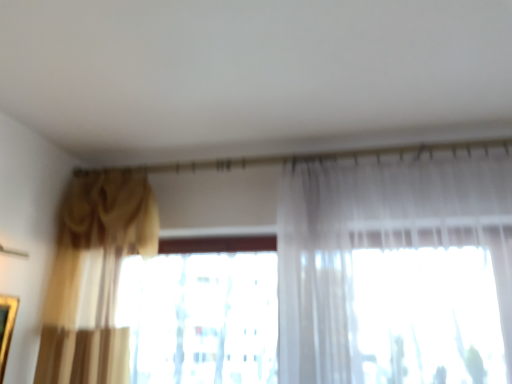
What do you see at coordinates (201, 317) in the screenshot?
I see `translucent fabric at center` at bounding box center [201, 317].

Locate an element on the screen. The width and height of the screenshot is (512, 384). translucent fabric at center is located at coordinates (201, 317).

Image resolution: width=512 pixels, height=384 pixels. Find the location of `gold textured curtain at left`. gold textured curtain at left is located at coordinates pos(94,276).

The image size is (512, 384). What do you see at coordinates (94, 276) in the screenshot? I see `gold textured curtain at left` at bounding box center [94, 276].

Find the location of `translucent fabric at center`. translucent fabric at center is located at coordinates (201, 317).

Based on the photo, considering the positions of objects translucent fabric at center and gold textured curtain at left in the image provided, who is more to the right, translucent fabric at center or gold textured curtain at left?

Positioned to the right is translucent fabric at center.

Does translucent fabric at center come in front of gold textured curtain at left?

No, translucent fabric at center is behind gold textured curtain at left.

Considering the positions of points (137, 263) and (63, 252), is point (137, 263) farther from camera compared to point (63, 252)?

No, it is in front of (63, 252).

From the image's perspective, who appears lower, translucent fabric at center or gold textured curtain at left?

From the image's view, translucent fabric at center is below.

From a real-world perspective, between translucent fabric at center and gold textured curtain at left, who is vertically higher?

gold textured curtain at left is physically above.

Is translucent fabric at center wider than gold textured curtain at left?

In fact, translucent fabric at center might be narrower than gold textured curtain at left.

Is translucent fabric at center taller than gold textured curtain at left?

In fact, translucent fabric at center may be shorter than gold textured curtain at left.

Looking at the image, does translucent fabric at center seem bigger or smaller compared to gold textured curtain at left?

In the image, translucent fabric at center appears to be smaller than gold textured curtain at left.

Would you say translucent fabric at center contains gold textured curtain at left?

No.

Is translucent fabric at center beside gold textured curtain at left?

No, translucent fabric at center is not next to gold textured curtain at left.

Is translucent fabric at center positioned with its back to gold textured curtain at left?

No, translucent fabric at center is not facing away from gold textured curtain at left.

How different are the orientations of translucent fabric at center and gold textured curtain at left in degrees?

The angle between the facing direction of translucent fabric at center and the facing direction of gold textured curtain at left is 0.295 degrees.

Find the location of a particular element. The width and height of the screenshot is (512, 384). window that is behind the gold textured curtain at left is located at coordinates click(x=201, y=317).

Based on their positions, is gold textured curtain at left located to the left or right of translucent fabric at center?

gold textured curtain at left is to the left of translucent fabric at center.

Considering the positions of objects gold textured curtain at left and translucent fabric at center in the image provided, who is behind, gold textured curtain at left or translucent fabric at center?

translucent fabric at center is more distant.

Does point (41, 364) come behind point (189, 376)?

That is False.

From the image's perspective, between gold textured curtain at left and translucent fabric at center, which one is located above?

gold textured curtain at left is shown above in the image.

Consider the image. From a real-world perspective, is gold textured curtain at left under translucent fabric at center?

Incorrect, from a real-world perspective, gold textured curtain at left is higher than translucent fabric at center.

Is gold textured curtain at left wider than translucent fabric at center?

Correct, the width of gold textured curtain at left exceeds that of translucent fabric at center.

In the scene shown: Does gold textured curtain at left have a greater height compared to translucent fabric at center?

Indeed, gold textured curtain at left has a greater height compared to translucent fabric at center.

Based on their sizes in the image, would you say gold textured curtain at left is bigger or smaller than translucent fabric at center?

Clearly, gold textured curtain at left is larger in size than translucent fabric at center.

Choose the correct answer: Is gold textured curtain at left inside translucent fabric at center or outside it?

Answer: gold textured curtain at left is not inside translucent fabric at center, it's outside.

Is gold textured curtain at left in contact with translucent fabric at center?

No, gold textured curtain at left is not making contact with translucent fabric at center.

Is gold textured curtain at left turned away from translucent fabric at center?

That's right, gold textured curtain at left is facing away from translucent fabric at center.

How different are the orientations of gold textured curtain at left and translucent fabric at center in degrees?

0.295 degrees.

I want to click on curtain lying above the translucent fabric at center (from the image's perspective), so click(94, 276).

The height and width of the screenshot is (384, 512). In order to click on curtain in front of the translucent fabric at center in this screenshot , I will do `click(94, 276)`.

Locate an element on the screen. window below the gold textured curtain at left (from a real-world perspective) is located at coordinates (201, 317).